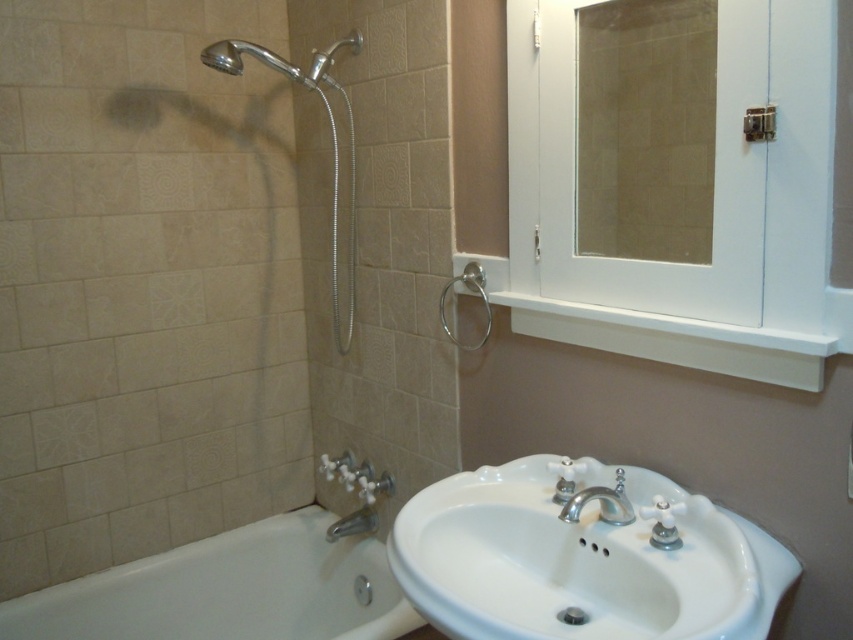
You are standing in the bathroom and want to see your reflection in the matte glass mirror at upper center. Can you do so while standing in front of the white glossy bathtub at lower left?

Yes, because the matte glass mirror at upper center is behind the white glossy bathtub at lower left, so you can see your reflection while standing in front of it.

You are a bathroom designer and need to ensure that the white glossy bathtub at lower left is not directly under the matte glass mirror at upper center to avoid water splashing onto it. Is this requirement currently met?

The white glossy bathtub at lower left is positioned under the matte glass mirror at upper center, so the requirement is not met. The bathtub is directly under the mirror, which may cause water splashing.